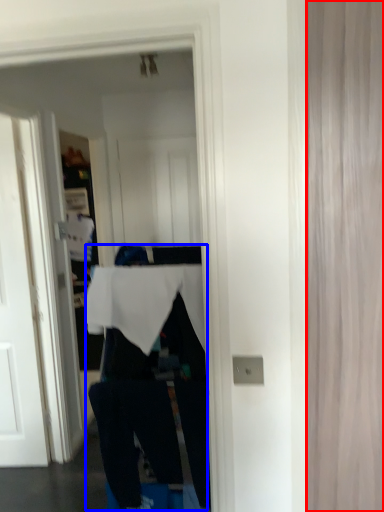
Question: Which object is further to the camera taking this photo, curtain (highlighted by a red box) or person (highlighted by a blue box)?

Choices:
 (A) curtain
 (B) person

Answer: (B)